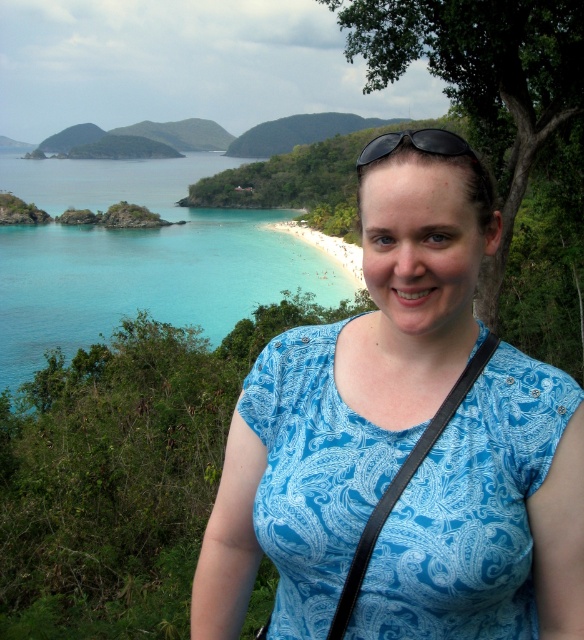
Question: Can you confirm if blue paisley shirt at center is wider than black plastic sunglasses at upper center?

Choices:
 (A) no
 (B) yes

Answer: (A)

Question: Can you confirm if turquoise water at upper left is thinner than black plastic sunglasses at upper center?

Choices:
 (A) no
 (B) yes

Answer: (A)

Question: Is blue paisley shirt at center closer to camera compared to black plastic sunglasses at upper center?

Choices:
 (A) yes
 (B) no

Answer: (A)

Question: Among these objects, which one is farthest from the camera?

Choices:
 (A) black plastic sunglasses at upper center
 (B) blue paisley shirt at center

Answer: (A)

Question: Estimate the real-world distances between objects in this image. Which object is closer to the turquoise water at upper left?

Choices:
 (A) black plastic sunglasses at upper center
 (B) blue paisley shirt at center

Answer: (B)

Question: Which point appears farthest from the camera in this image?

Choices:
 (A) (547, 552)
 (B) (336, 292)
 (C) (380, 150)

Answer: (B)